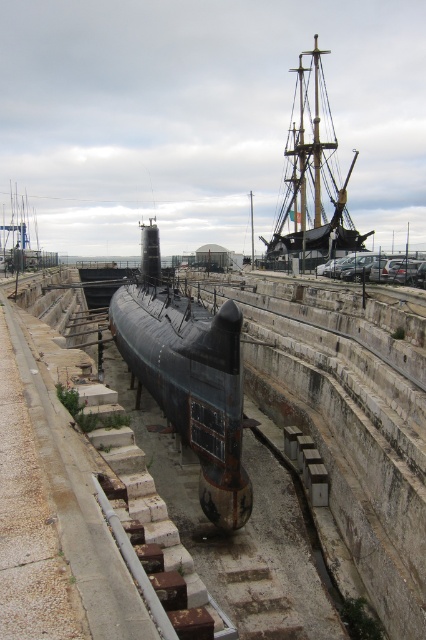
Question: Can you confirm if rusty metal submarine at center is positioned below rusty metal ship at upper right?

Choices:
 (A) no
 (B) yes

Answer: (B)

Question: Is rusty metal submarine at center to the left of rusty metal ship at upper right from the viewer's perspective?

Choices:
 (A) no
 (B) yes

Answer: (B)

Question: Which object is closer to the camera taking this photo?

Choices:
 (A) rusty metal ship at upper right
 (B) rusty metal submarine at center

Answer: (B)

Question: Which object is farther from the camera taking this photo?

Choices:
 (A) rusty metal submarine at center
 (B) rusty metal ship at upper right

Answer: (B)

Question: Does rusty metal submarine at center have a smaller size compared to rusty metal ship at upper right?

Choices:
 (A) no
 (B) yes

Answer: (B)

Question: Which object is closer to the camera taking this photo?

Choices:
 (A) rusty metal ship at upper right
 (B) rusty metal submarine at center

Answer: (B)